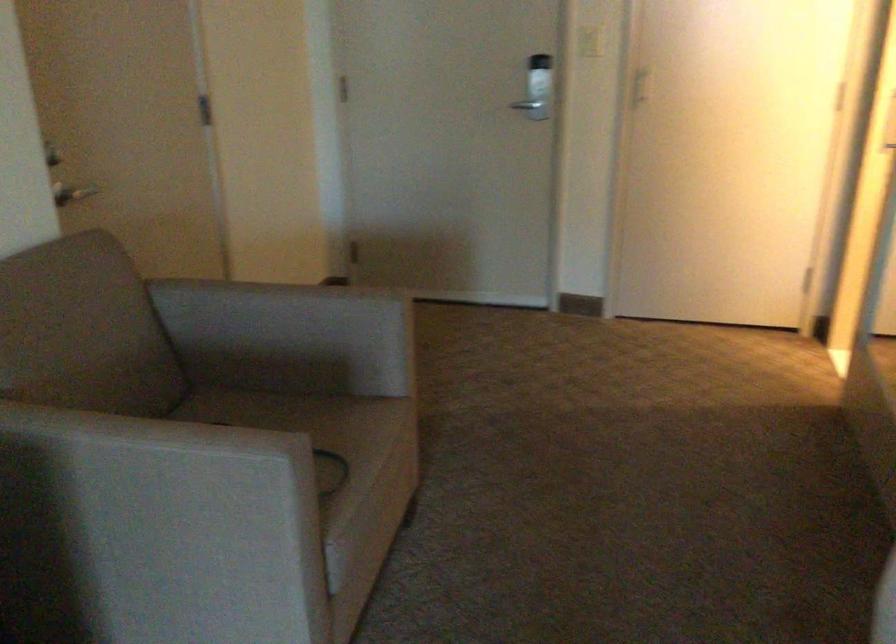
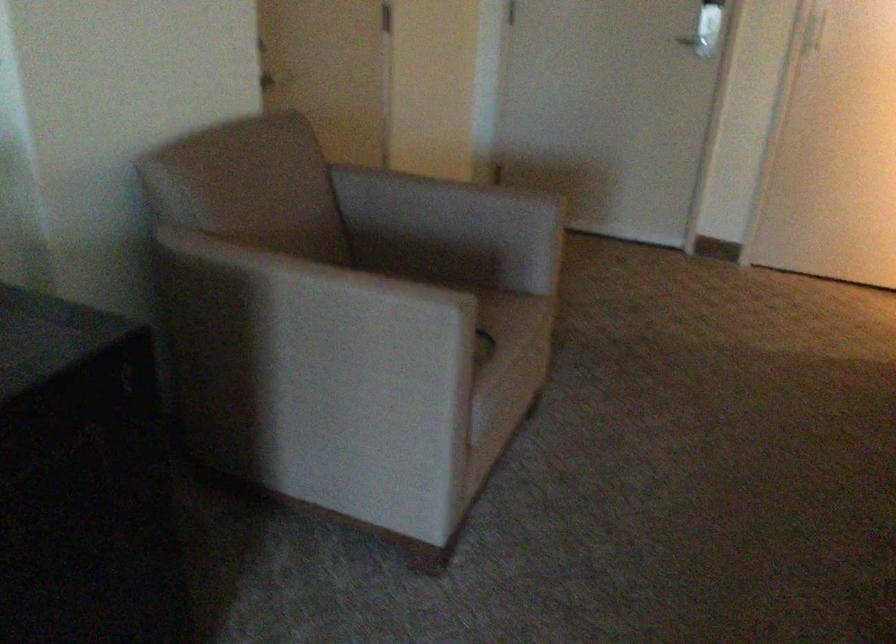
Question: The camera is either moving clockwise (left) or counter-clockwise (right) around the object. The first image is from the beginning of the video and the second image is from the end. Is the camera moving left or right when shooting the video?

Choices:
 (A) Left
 (B) Right

Answer: (B)